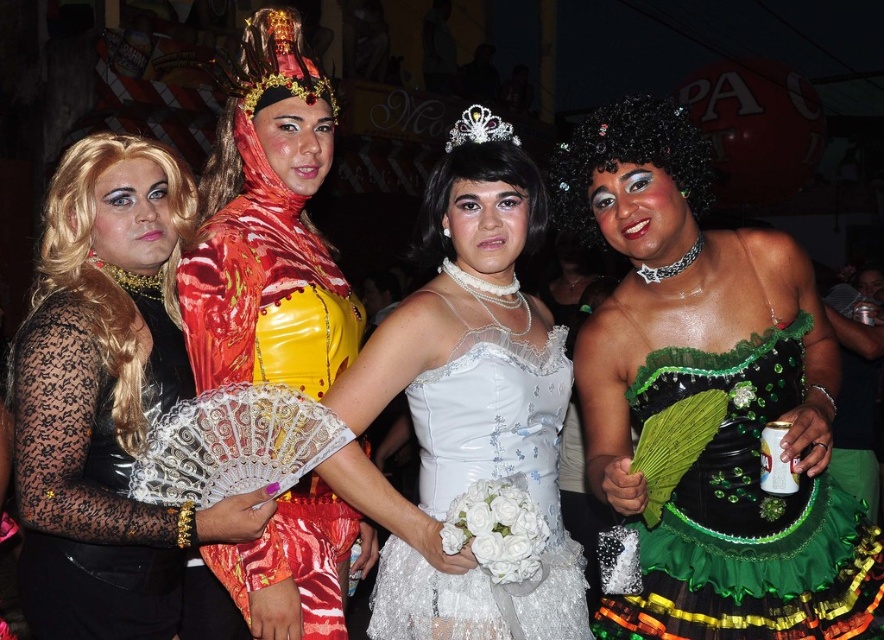
Which is more to the right, black lace dress at left or green sequined dress at right?

green sequined dress at right

Between black lace dress at left and green sequined dress at right, which one is positioned lower?

green sequined dress at right is lower down.

I want to click on black lace dress at left, so click(x=105, y=397).

Who is positioned more to the left, green sequined dress at right or white satin dress at center?

white satin dress at center

Who is taller, green sequined dress at right or white satin dress at center?

With more height is green sequined dress at right.

Measure the distance between point (855, 616) and camera.

A distance of 9.45 feet exists between point (855, 616) and camera.

Identify the location of green sequined dress at right. [745, 516].

Is point (332, 344) behind point (700, 612)?

Yes, it is.

Does shiny red fabric at center have a larger size compared to green sequined dress at right?

Yes, shiny red fabric at center is bigger than green sequined dress at right.

Does point (248, 625) lie behind point (658, 611)?

Yes, it is.

The height and width of the screenshot is (640, 884). I want to click on shiny red fabric at center, so click(268, 227).